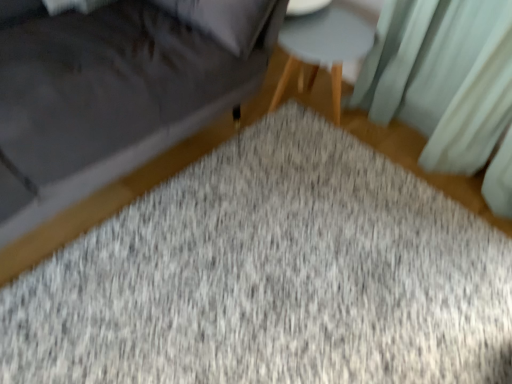
Question: Could you tell me if light teal fabric curtain at upper right is turned towards velvet gray sofa at lower left?

Choices:
 (A) no
 (B) yes

Answer: (A)

Question: Does light teal fabric curtain at upper right appear on the left side of velvet gray sofa at lower left?

Choices:
 (A) yes
 (B) no

Answer: (B)

Question: From the image's perspective, would you say light teal fabric curtain at upper right is shown under velvet gray sofa at lower left?

Choices:
 (A) no
 (B) yes

Answer: (B)

Question: Can you confirm if light teal fabric curtain at upper right is wider than velvet gray sofa at lower left?

Choices:
 (A) no
 (B) yes

Answer: (A)

Question: Would you say light teal fabric curtain at upper right is outside velvet gray sofa at lower left?

Choices:
 (A) no
 (B) yes

Answer: (B)

Question: Is light teal fabric curtain at upper right directly adjacent to velvet gray sofa at lower left?

Choices:
 (A) no
 (B) yes

Answer: (A)

Question: From a real-world perspective, is gray textured mat at center physically below light gray wood stool at center?

Choices:
 (A) yes
 (B) no

Answer: (A)

Question: Is light gray wood stool at center at the back of gray textured mat at center?

Choices:
 (A) no
 (B) yes

Answer: (A)

Question: Is gray textured mat at center to the right of light gray wood stool at center from the viewer's perspective?

Choices:
 (A) yes
 (B) no

Answer: (B)

Question: Can you confirm if gray textured mat at center is smaller than light gray wood stool at center?

Choices:
 (A) yes
 (B) no

Answer: (B)

Question: From a real-world perspective, is gray textured mat at center located higher than light gray wood stool at center?

Choices:
 (A) no
 (B) yes

Answer: (A)

Question: From the image's perspective, is gray textured mat at center below light gray wood stool at center?

Choices:
 (A) yes
 (B) no

Answer: (A)

Question: Can you confirm if light gray wood stool at center is bigger than velvet gray sofa at lower left?

Choices:
 (A) no
 (B) yes

Answer: (A)